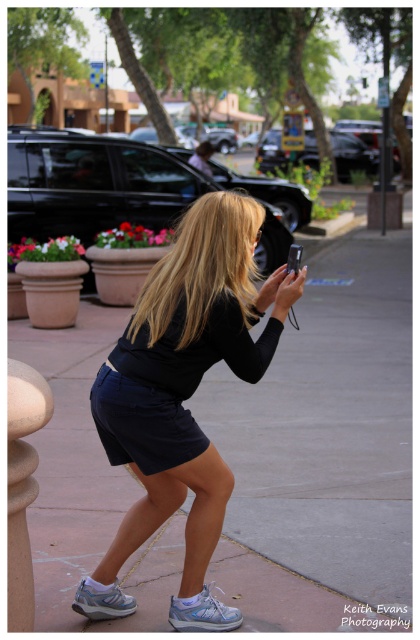
Question: Among these points, which one is nearest to the camera?

Choices:
 (A) (152, 422)
 (B) (291, 266)
 (C) (157, 352)

Answer: (A)

Question: Can you confirm if blonde hair at center is thinner than matte black smartphone at center?

Choices:
 (A) yes
 (B) no

Answer: (B)

Question: Which object is the farthest from the black cotton dress at center?

Choices:
 (A) matte black smartphone at center
 (B) blonde hair at center
 (C) black matte shorts at center

Answer: (A)

Question: Is black cotton dress at center thinner than matte black smartphone at center?

Choices:
 (A) no
 (B) yes

Answer: (A)

Question: Is blonde hair at center further to camera compared to matte black smartphone at center?

Choices:
 (A) yes
 (B) no

Answer: (B)

Question: Which object is the farthest from the black matte shorts at center?

Choices:
 (A) matte black smartphone at center
 (B) black cotton dress at center
 (C) blonde hair at center

Answer: (A)